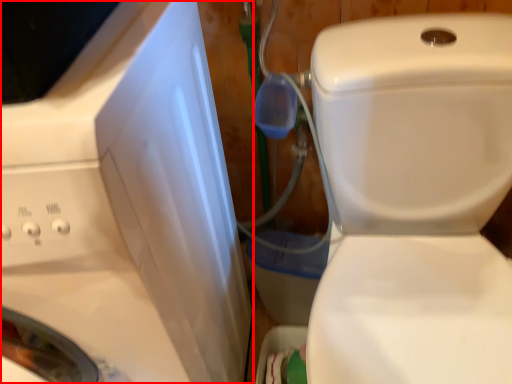
Question: From the image's perspective, what is the correct spatial relationship of washing machine (annotated by the red box) in relation to toilet?

Choices:
 (A) below
 (B) above

Answer: (B)